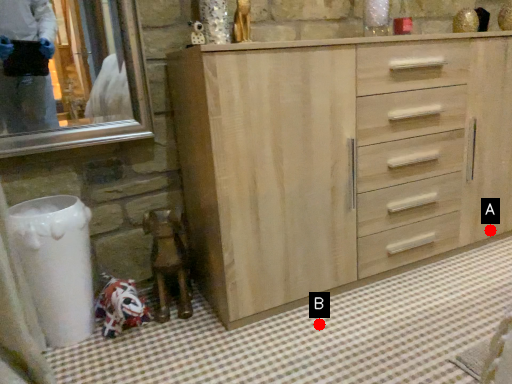
Question: Two points are circled on the image, labeled by A and B beside each circle. Which point is closer to the camera taking this photo?

Choices:
 (A) A is closer
 (B) B is closer

Answer: (B)